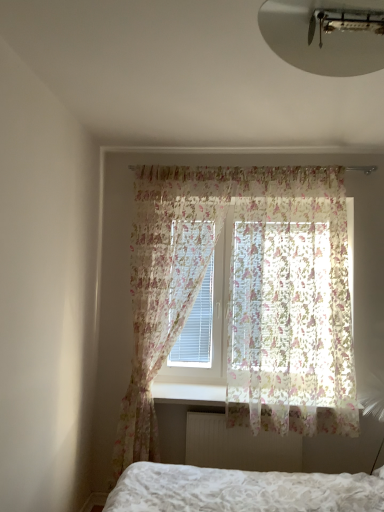
The width and height of the screenshot is (384, 512). What do you see at coordinates (239, 446) in the screenshot?
I see `white textured radiator at lower center` at bounding box center [239, 446].

Image resolution: width=384 pixels, height=512 pixels. Describe the element at coordinates (326, 34) in the screenshot. I see `white matte ceiling light at upper center` at that location.

This screenshot has width=384, height=512. What are the coordinates of `white textured radiator at lower center` in the screenshot? It's located at (239, 446).

From the image's perspective, does white textured radiator at lower center appear lower than white matte ceiling light at upper center?

Yes.

Can you confirm if white textured radiator at lower center is thinner than white matte ceiling light at upper center?

Yes.

From the picture: Between white textured radiator at lower center and white matte ceiling light at upper center, which one has more height?

With more height is white textured radiator at lower center.

Is translucent floral fabric at center, the 2th curtain in the right-to-left sequence, not close to white plastic radiator at lower center?

translucent floral fabric at center, the 2th curtain in the right-to-left sequence, is actually quite close to white plastic radiator at lower center.

Can you confirm if translucent floral fabric at center, the 2th curtain in the right-to-left sequence, is positioned to the right of white plastic radiator at lower center?

In fact, translucent floral fabric at center, the 2th curtain in the right-to-left sequence, is to the left of white plastic radiator at lower center.

From the image's perspective, between translucent floral fabric at center, positioned as the first curtain in left-to-right order, and white plastic radiator at lower center, which one is located above?

translucent floral fabric at center, positioned as the first curtain in left-to-right order.

Who is smaller, white textured bed at lower center or white matte ceiling light at upper center?

white matte ceiling light at upper center is smaller.

Is white textured bed at lower center turned away from white matte ceiling light at upper center?

That's not correct — white textured bed at lower center is not looking away from white matte ceiling light at upper center.

Considering the points (173, 468) and (344, 63), which point is behind, point (173, 468) or point (344, 63)?

The point (173, 468) is more distant.

Is white textured bed at lower center closer to the viewer compared to white matte ceiling light at upper center?

No, it is behind white matte ceiling light at upper center.

In order to click on light fixture lying above the white plastic radiator at lower center (from the image's perspective) in this screenshot , I will do `click(326, 34)`.

Does white matte ceiling light at upper center have a larger size compared to white plastic radiator at lower center?

Incorrect, white matte ceiling light at upper center is not larger than white plastic radiator at lower center.

Is white matte ceiling light at upper center touching white plastic radiator at lower center?

No, white matte ceiling light at upper center is not touching white plastic radiator at lower center.

In order to click on bed to the left of white plastic radiator at lower center in this screenshot , I will do `click(239, 477)`.

Is white plastic radiator at lower center positioned before white textured bed at lower center?

No, the depth of white plastic radiator at lower center is greater than that of white textured bed at lower center.

Is white plastic radiator at lower center located outside white textured bed at lower center?

Indeed, white plastic radiator at lower center is completely outside white textured bed at lower center.

Considering the relative sizes of white plastic radiator at lower center and white textured bed at lower center in the image provided, is white plastic radiator at lower center bigger than white textured bed at lower center?

Incorrect, white plastic radiator at lower center is not larger than white textured bed at lower center.

How different are the orientations of white textured radiator at lower center and translucent floral fabric at upper center, the 1th curtain from the right, in degrees?

There is a 0.315-degree angle between the facing directions of white textured radiator at lower center and translucent floral fabric at upper center, the 1th curtain from the right.

Does white textured radiator at lower center come behind translucent floral fabric at upper center, which is counted as the 2th curtain, starting from the left?

Yes, white textured radiator at lower center is further from the camera.

Considering the relative positions of white textured radiator at lower center and translucent floral fabric at upper center, the 1th curtain from the right, in the image provided, is white textured radiator at lower center to the left of translucent floral fabric at upper center, the 1th curtain from the right, from the viewer's perspective?

Yes.

In the scene shown: Is white textured radiator at lower center wider than translucent floral fabric at upper center, which is counted as the 2th curtain, starting from the left?

No.

In the image, is white matte ceiling light at upper center on the left side or the right side of white textured radiator at lower center?

In the image, white matte ceiling light at upper center appears on the left side of white textured radiator at lower center.

I want to click on radiator behind the white matte ceiling light at upper center, so click(x=239, y=446).

From the image's perspective, which is above, white matte ceiling light at upper center or white textured radiator at lower center?

white matte ceiling light at upper center appears higher in the image.

Is white matte ceiling light at upper center in contact with white textured radiator at lower center?

They are not placed beside each other.

You are a GUI agent. You are given a task and a screenshot of the screen. Output one action in this format:
    pyautogui.click(x=<x>, y=<y>)
    Task: Click on the radiator on the right side of white matte ceiling light at upper center
    This screenshot has width=384, height=512.
    Given the screenshot: What is the action you would take?
    pyautogui.click(x=239, y=446)

Identify the location of window sill below the translucent floral fabric at center, the 2th curtain in the right-to-left sequence (from a real-world perspective). Image resolution: width=384 pixels, height=512 pixels. 189,393.

Based on their spatial positions, is translucent floral fabric at center, positioned as the first curtain in left-to-right order, or translucent floral fabric at upper center, which is counted as the 2th curtain, starting from the left, further from white plastic radiator at lower center?

translucent floral fabric at upper center, which is counted as the 2th curtain, starting from the left, lies further to white plastic radiator at lower center than the other object.

From the image, which object appears to be farther from translucent floral fabric at upper center, the 1th curtain from the right, white textured radiator at lower center or white matte ceiling light at upper center?

Based on the image, white matte ceiling light at upper center appears to be further to translucent floral fabric at upper center, the 1th curtain from the right.

Looking at the image, which one is located further to white matte ceiling light at upper center, white textured radiator at lower center or translucent floral fabric at upper center, which is counted as the 2th curtain, starting from the left?

Based on the image, white textured radiator at lower center appears to be further to white matte ceiling light at upper center.

From the image, which object appears to be farther from white textured radiator at lower center, white matte ceiling light at upper center or white plastic radiator at lower center?

white matte ceiling light at upper center is positioned further to the anchor white textured radiator at lower center.

Considering their positions, is white textured bed at lower center positioned closer to translucent floral fabric at center, the 2th curtain in the right-to-left sequence, than translucent floral fabric at upper center, the 1th curtain from the right?

The object closer to translucent floral fabric at center, the 2th curtain in the right-to-left sequence, is translucent floral fabric at upper center, the 1th curtain from the right.

Looking at the image, which one is located closer to white textured radiator at lower center, translucent floral fabric at center, positioned as the first curtain in left-to-right order, or white matte ceiling light at upper center?

The object closer to white textured radiator at lower center is translucent floral fabric at center, positioned as the first curtain in left-to-right order.

When comparing their distances from white textured bed at lower center, does white plastic radiator at lower center or translucent floral fabric at center, positioned as the first curtain in left-to-right order, seem further?

Among the two, translucent floral fabric at center, positioned as the first curtain in left-to-right order, is located further to white textured bed at lower center.

Which object lies nearer to the anchor point white plastic radiator at lower center, white textured bed at lower center or white matte ceiling light at upper center?

white textured bed at lower center lies closer to white plastic radiator at lower center than the other object.

Locate an element on the screen. The image size is (384, 512). window sill between white matte ceiling light at upper center and white textured bed at lower center vertically is located at coordinates [x=189, y=393].

I want to click on window sill between white textured bed at lower center and white textured radiator at lower center in the front-back direction, so click(x=189, y=393).

This screenshot has height=512, width=384. In order to click on window sill between translucent floral fabric at upper center, which is counted as the 2th curtain, starting from the left, and white textured radiator at lower center in the up-down direction in this screenshot , I will do `click(189, 393)`.

Identify the location of window sill between translucent floral fabric at center, the 2th curtain in the right-to-left sequence, and white textured radiator at lower center from top to bottom. The image size is (384, 512). (189, 393).